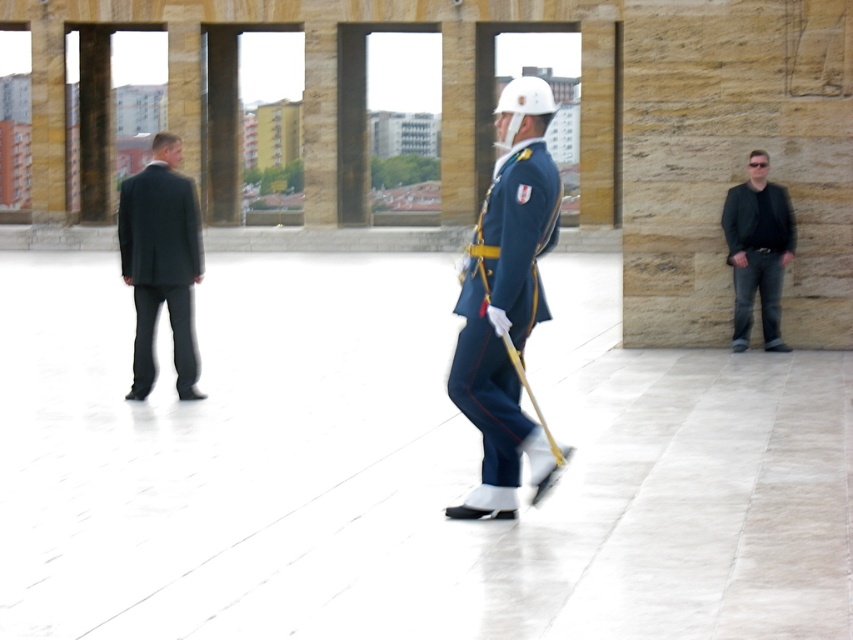
Does dark gray suit at left have a smaller size compared to black leather jacket at right?

Yes.

Describe the element at coordinates (161, 262) in the screenshot. I see `dark gray suit at left` at that location.

The image size is (853, 640). What do you see at coordinates (161, 262) in the screenshot?
I see `dark gray suit at left` at bounding box center [161, 262].

You are a GUI agent. You are given a task and a screenshot of the screen. Output one action in this format:
    pyautogui.click(x=<x>, y=<y>)
    Task: Click on the dark gray suit at left
    Image resolution: width=853 pixels, height=640 pixels.
    Given the screenshot: What is the action you would take?
    pyautogui.click(x=161, y=262)

Who is shorter, blue uniform at center or black leather jacket at right?

With less height is blue uniform at center.

Between point (488, 248) and point (732, 269), which one is positioned in front?

Point (488, 248) is in front.

The image size is (853, 640). Find the location of `blue uniform at center`. blue uniform at center is located at coordinates (506, 300).

Is blue uniform at center bigger than dark gray suit at left?

Actually, blue uniform at center might be smaller than dark gray suit at left.

Describe the element at coordinates (506, 300) in the screenshot. This screenshot has height=640, width=853. I see `blue uniform at center` at that location.

Locate an element on the screen. This screenshot has height=640, width=853. blue uniform at center is located at coordinates (506, 300).